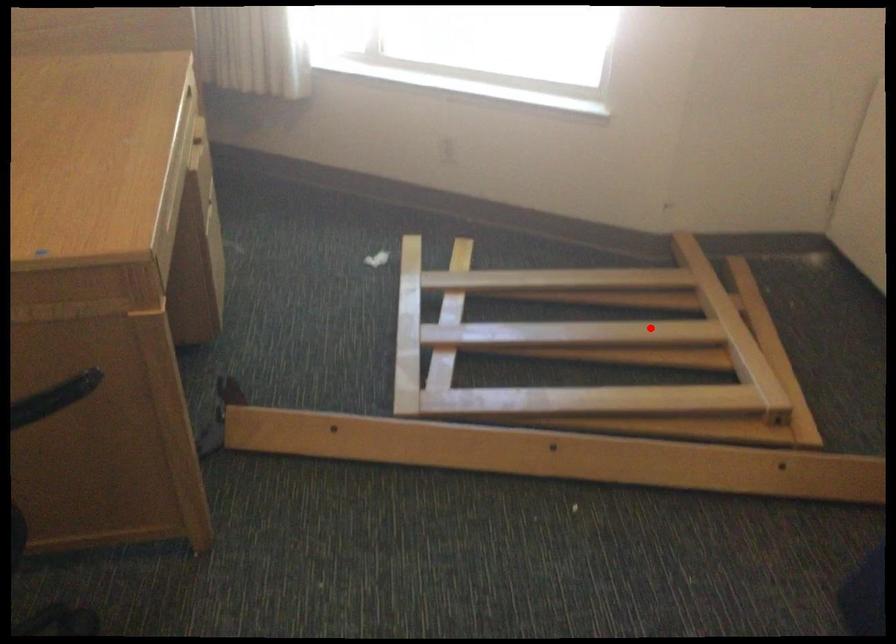
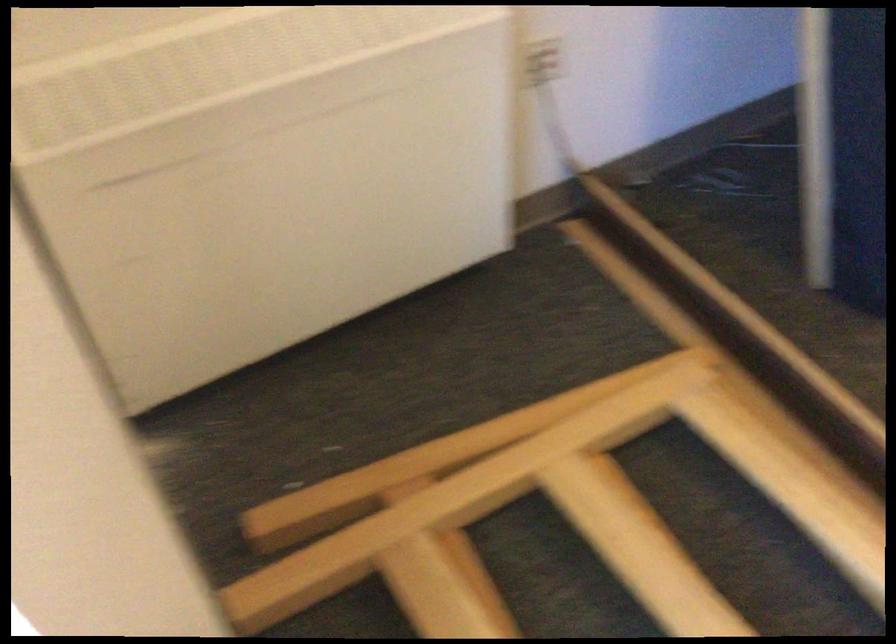
Question: I am providing you with two images of the same scene from different viewpoints. In image1, a red point is highlighted. Considering the same 3D point in image2, which of the following is correct?

Choices:
 (A) It is closer
 (B) It is farther

Answer: (A)